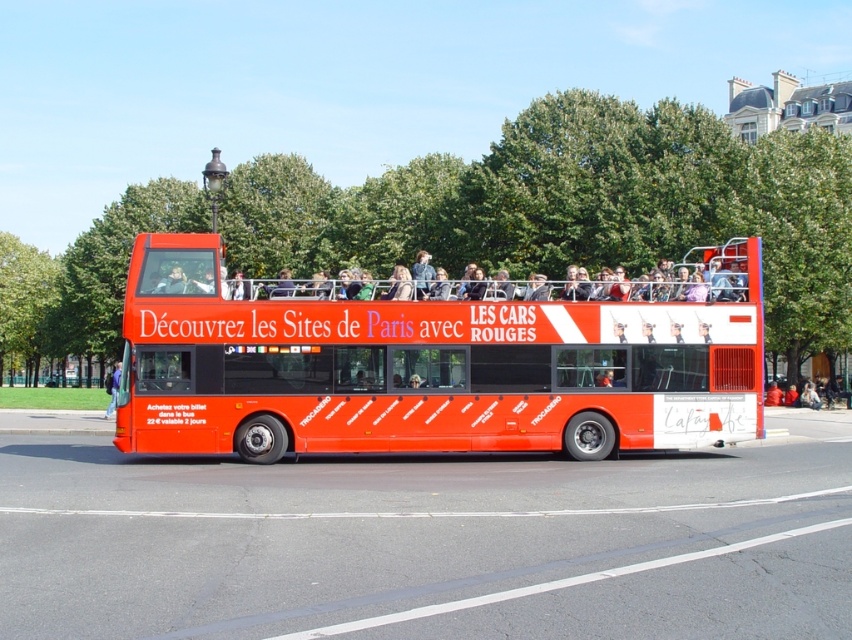
Question: Does shiny red bus at center come in front of green leafy tree at left?

Choices:
 (A) yes
 (B) no

Answer: (A)

Question: Which is farther from the green leafy tree at center?

Choices:
 (A) green leafy tree at left
 (B) shiny red bus at center

Answer: (B)

Question: Estimate the real-world distances between objects in this image. Which object is closer to the shiny red bus at center?

Choices:
 (A) green leafy tree at center
 (B) green leafy tree at left

Answer: (A)

Question: Among these points, which one is nearest to the camera?

Choices:
 (A) (707, 307)
 (B) (160, 188)

Answer: (A)

Question: Can you confirm if green leafy tree at center is positioned below green leafy tree at left?

Choices:
 (A) yes
 (B) no

Answer: (B)

Question: Can you confirm if shiny red bus at center is bigger than green leafy tree at left?

Choices:
 (A) yes
 (B) no

Answer: (B)